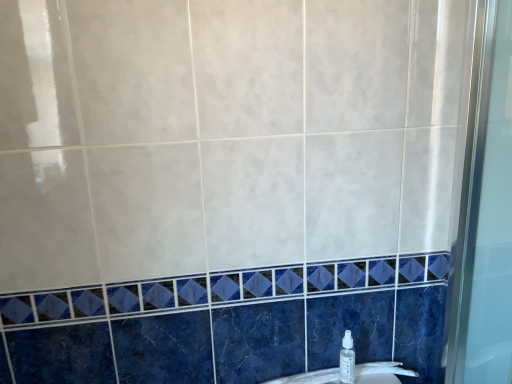
Question: Considering the relative sizes of white glossy sink at lower center and clear plastic spray bottle at lower right in the image provided, is white glossy sink at lower center taller than clear plastic spray bottle at lower right?

Choices:
 (A) no
 (B) yes

Answer: (A)

Question: Is white glossy sink at lower center positioned behind clear plastic spray bottle at lower right?

Choices:
 (A) no
 (B) yes

Answer: (B)

Question: Does white glossy sink at lower center lie in front of clear plastic spray bottle at lower right?

Choices:
 (A) no
 (B) yes

Answer: (A)

Question: Is white glossy sink at lower center facing towards clear plastic spray bottle at lower right?

Choices:
 (A) yes
 (B) no

Answer: (B)

Question: Can clear plastic spray bottle at lower right be found inside white glossy sink at lower center?

Choices:
 (A) yes
 (B) no

Answer: (B)

Question: Considering the relative sizes of white glossy sink at lower center and clear plastic spray bottle at lower right in the image provided, is white glossy sink at lower center bigger than clear plastic spray bottle at lower right?

Choices:
 (A) yes
 (B) no

Answer: (A)

Question: Does clear plastic spray bottle at lower right appear on the right side of white glossy sink at lower center?

Choices:
 (A) no
 (B) yes

Answer: (B)

Question: From the image's perspective, is clear plastic spray bottle at lower right under white glossy sink at lower center?

Choices:
 (A) no
 (B) yes

Answer: (A)

Question: Is the depth of clear plastic spray bottle at lower right greater than that of white glossy sink at lower center?

Choices:
 (A) yes
 (B) no

Answer: (B)

Question: Is clear plastic spray bottle at lower right at the left side of white glossy sink at lower center?

Choices:
 (A) no
 (B) yes

Answer: (A)

Question: Considering the relative sizes of clear plastic spray bottle at lower right and white glossy sink at lower center in the image provided, is clear plastic spray bottle at lower right bigger than white glossy sink at lower center?

Choices:
 (A) yes
 (B) no

Answer: (B)

Question: Does clear plastic spray bottle at lower right have a lesser width compared to white glossy sink at lower center?

Choices:
 (A) yes
 (B) no

Answer: (B)

Question: Is clear plastic spray bottle at lower right wider or thinner than white glossy sink at lower center?

Choices:
 (A) wide
 (B) thin

Answer: (A)